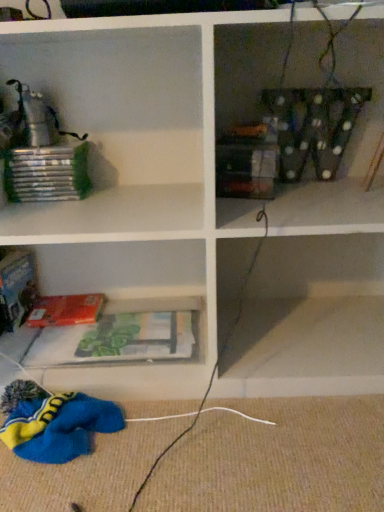
This screenshot has width=384, height=512. What do you see at coordinates (123, 335) in the screenshot? I see `matte plastic books at lower center` at bounding box center [123, 335].

Find the location of a particular element. matte plastic books at lower center is located at coordinates (123, 335).

Measure the distance between point (101, 323) and camera.

The distance of point (101, 323) from camera is 3.98 feet.

I want to click on hardcover book at lower left, so click(x=66, y=310).

This screenshot has width=384, height=512. Describe the element at coordinates (66, 310) in the screenshot. I see `hardcover book at lower left` at that location.

At what (x,y) coordinates should I click in order to perform the action: click on matte plastic books at lower center. Please return your answer as a coordinate pair (x, y). This screenshot has height=512, width=384. Looking at the image, I should click on (123, 335).

Between matte plastic books at lower center and hardcover book at lower left, which one appears on the left side from the viewer's perspective?

hardcover book at lower left is more to the left.

In the scene shown: Considering their positions, is matte plastic books at lower center located in front of or behind hardcover book at lower left?

In the image, matte plastic books at lower center appears in front of hardcover book at lower left.

Is point (35, 345) farther from viewer compared to point (95, 318)?

No, (35, 345) is closer to viewer.

Consider the image. From the image's perspective, is matte plastic books at lower center on top of hardcover book at lower left?

Incorrect, from the image's perspective, matte plastic books at lower center is lower than hardcover book at lower left.

From a real-world perspective, who is located higher, matte plastic books at lower center or hardcover book at lower left?

matte plastic books at lower center is physically above.

Can you confirm if matte plastic books at lower center is wider than hardcover book at lower left?

Yes.

From their relative heights in the image, would you say matte plastic books at lower center is taller or shorter than hardcover book at lower left?

matte plastic books at lower center is taller than hardcover book at lower left.

Can you confirm if matte plastic books at lower center is smaller than hardcover book at lower left?

No.

Would you say hardcover book at lower left is part of matte plastic books at lower center's contents?

No, hardcover book at lower left is not inside matte plastic books at lower center.

Are matte plastic books at lower center and hardcover book at lower left far apart?

matte plastic books at lower center is near hardcover book at lower left, not far away.

Based on the photo, is matte plastic books at lower center facing towards hardcover book at lower left?

No, matte plastic books at lower center does not turn towards hardcover book at lower left.

How different are the orientations of matte plastic books at lower center and hardcover book at lower left in degrees?

0.00124 degrees.

How much distance is there between matte plastic books at lower center and hardcover book at lower left?

matte plastic books at lower center is 5.21 inches away from hardcover book at lower left.

The width and height of the screenshot is (384, 512). In order to click on cabinet on the right of hardcover book at lower left in this screenshot , I will do `click(123, 335)`.

Which object is positioned more to the right, hardcover book at lower left or matte plastic books at lower center?

matte plastic books at lower center.

Is hardcover book at lower left further to the viewer compared to matte plastic books at lower center?

Yes, hardcover book at lower left is behind matte plastic books at lower center.

Considering the points (98, 303) and (184, 358), which point is in front, point (98, 303) or point (184, 358)?

The point (184, 358) is closer to the camera.

From the image's perspective, between hardcover book at lower left and matte plastic books at lower center, who is located below?

matte plastic books at lower center.

From a real-world perspective, between hardcover book at lower left and matte plastic books at lower center, who is vertically higher?

matte plastic books at lower center is physically above.

In the scene shown: Which object is wider, hardcover book at lower left or matte plastic books at lower center?

matte plastic books at lower center is wider.

Who is shorter, hardcover book at lower left or matte plastic books at lower center?

With less height is hardcover book at lower left.

From the picture: Based on their sizes in the image, would you say hardcover book at lower left is bigger or smaller than matte plastic books at lower center?

Considering their sizes, hardcover book at lower left takes up less space than matte plastic books at lower center.

Is hardcover book at lower left outside of matte plastic books at lower center?

That's correct, hardcover book at lower left is outside of matte plastic books at lower center.

Is hardcover book at lower left with matte plastic books at lower center?

No.

Is hardcover book at lower left oriented towards matte plastic books at lower center?

No, hardcover book at lower left is not turned towards matte plastic books at lower center.

Locate an element on the screen. This screenshot has height=512, width=384. paperback book on the left of matte plastic books at lower center is located at coordinates (66, 310).

I want to click on cabinet in front of the hardcover book at lower left, so click(123, 335).

Identify the location of cabinet that is above the hardcover book at lower left (from a real-world perspective). Image resolution: width=384 pixels, height=512 pixels. (123, 335).